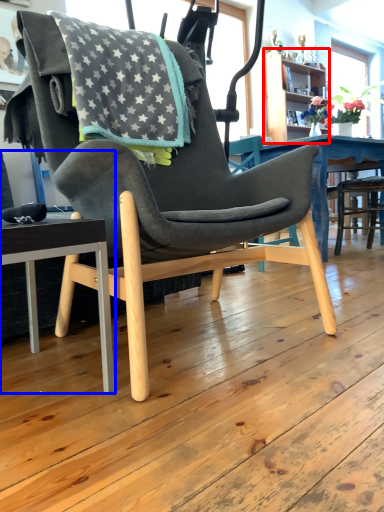
Question: Which of the following is the farthest to the observer, bookshelf (highlighted by a red box) or chair (highlighted by a blue box)?

Choices:
 (A) bookshelf
 (B) chair

Answer: (A)